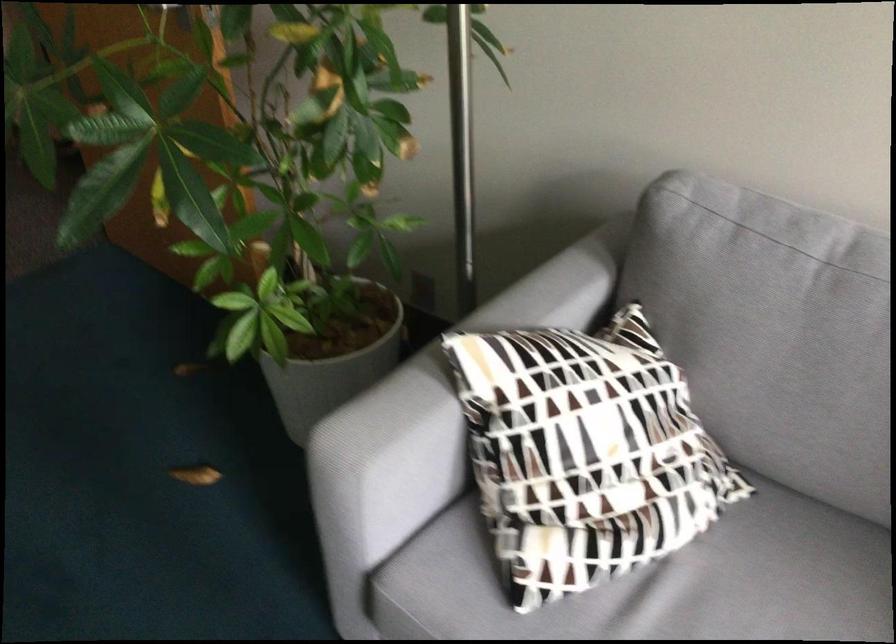
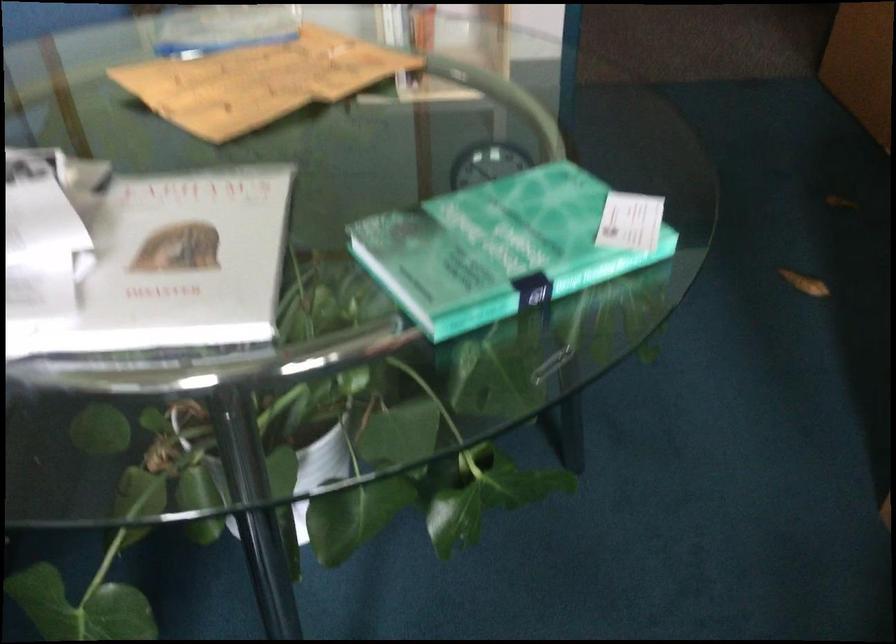
Question: The first image is from the beginning of the video and the second image is from the end. How did the camera likely rotate when shooting the video?

Choices:
 (A) Left
 (B) Right
 (C) Up
 (D) Down

Answer: (A)